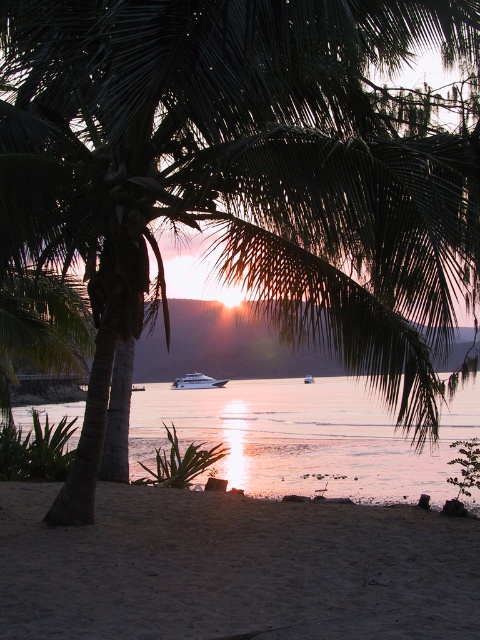
You are standing on the sandy at lower center and want to board the white glossy yacht at center. Which direction should you move to reach the yacht?

You should move upward from the sandy at lower center to reach the white glossy yacht at center since the yacht is positioned above the sandy area.

You are standing on the sandy at lower center and want to reach the glistening silver water at center. Which direction should you move to get closer to the water?

The glistening silver water at center is larger in size than the sandy at lower center. Since you are on the sandy at lower center, you should move forward towards the center of the image to reach the glistening silver water at center.